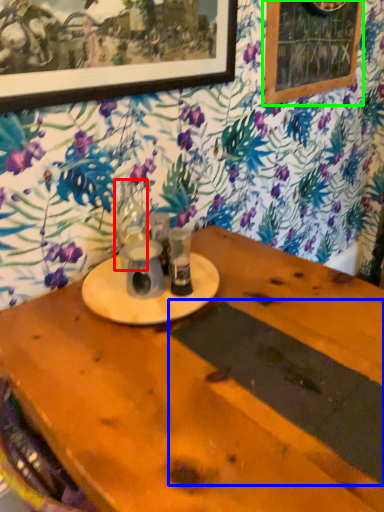
Question: Estimate the real-world distances between objects in this image. Which object is closer to tableware (highlighted by a red box), plank (highlighted by a blue box) or bulletin board (highlighted by a green box)?

Choices:
 (A) plank
 (B) bulletin board

Answer: (A)